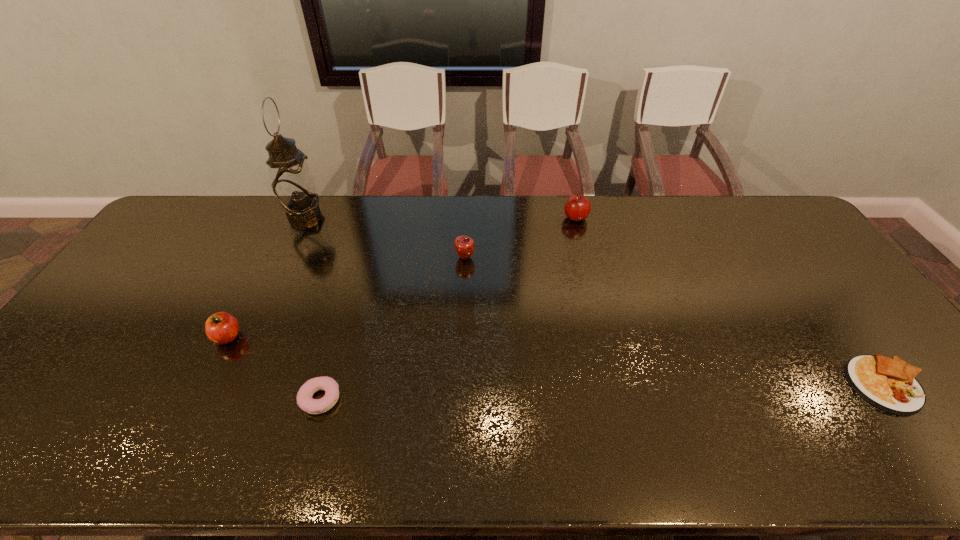
Find the location of a particular element. This screenshot has height=540, width=960. vacant region that satisfies the following two spatial constraints: 1. on the front side of the shortest object; 2. on the left side of the leftmost apple is located at coordinates (204, 385).

Locate an element on the screen. Image resolution: width=960 pixels, height=540 pixels. free point that satisfies the following two spatial constraints: 1. on the front side of the rightmost object; 2. on the right side of the leftmost apple is located at coordinates (204, 385).

Where is `free location that satisfies the following two spatial constraints: 1. on the front side of the third object from left to right; 2. on the left side of the leftmost apple`? The width and height of the screenshot is (960, 540). free location that satisfies the following two spatial constraints: 1. on the front side of the third object from left to right; 2. on the left side of the leftmost apple is located at coordinates pos(196,399).

Locate an element on the screen. This screenshot has height=540, width=960. free spot that satisfies the following two spatial constraints: 1. on the back side of the tallest apple; 2. on the right side of the fourth object from right to left is located at coordinates pos(372,218).

Where is `blank area in the image that satisfies the following two spatial constraints: 1. on the back side of the rightmost object; 2. on the left side of the fifth tallest object`? The image size is (960, 540). blank area in the image that satisfies the following two spatial constraints: 1. on the back side of the rightmost object; 2. on the left side of the fifth tallest object is located at coordinates (325, 385).